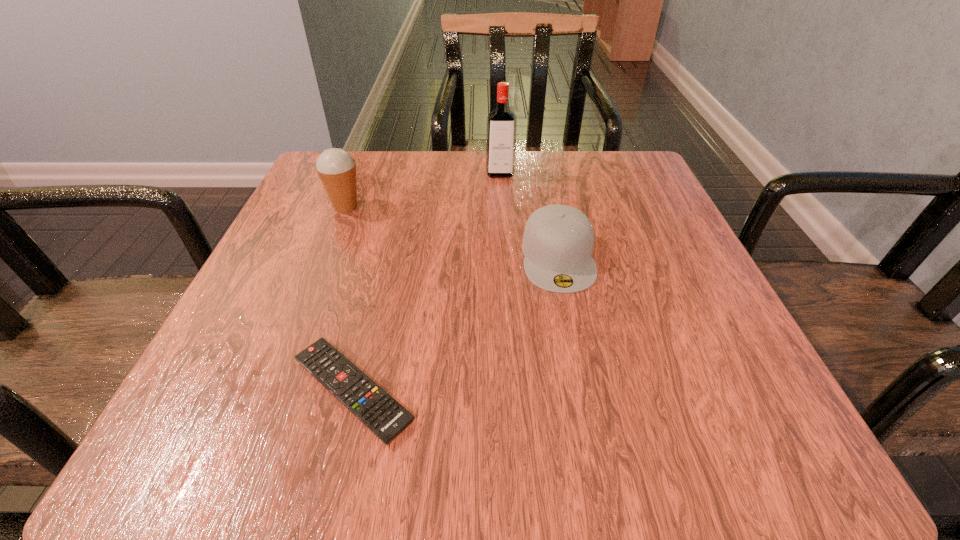
At what (x,y) coordinates should I click in order to perform the action: click on the farthest object. Please return your answer as a coordinate pair (x, y). Looking at the image, I should click on (501, 130).

Locate an element on the screen. This screenshot has width=960, height=540. vodka is located at coordinates (501, 130).

This screenshot has width=960, height=540. Identify the location of the second tallest object. (336, 168).

Where is `the second farthest object`? the second farthest object is located at coordinates (336, 168).

Locate an element on the screen. the third tallest object is located at coordinates (558, 240).

Locate an element on the screen. the second nearest object is located at coordinates (558, 240).

Identify the location of the shortest object. (382, 414).

You are a GUI agent. You are given a task and a screenshot of the screen. Output one action in this format:
    pyautogui.click(x=<x>, y=<y>)
    Task: Click on the remote control
    This screenshot has height=540, width=960.
    Given the screenshot: What is the action you would take?
    pyautogui.click(x=382, y=414)

This screenshot has height=540, width=960. I want to click on free space located 0.180m on the front and back of the tallest object, so click(504, 230).

Image resolution: width=960 pixels, height=540 pixels. Identify the location of vacant point located on the back of the third nearest object. (367, 154).